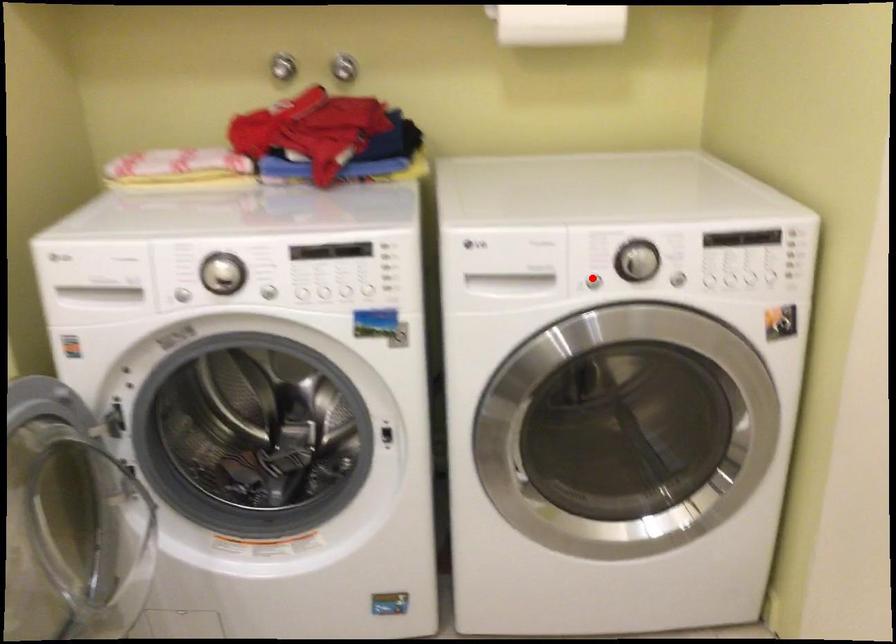
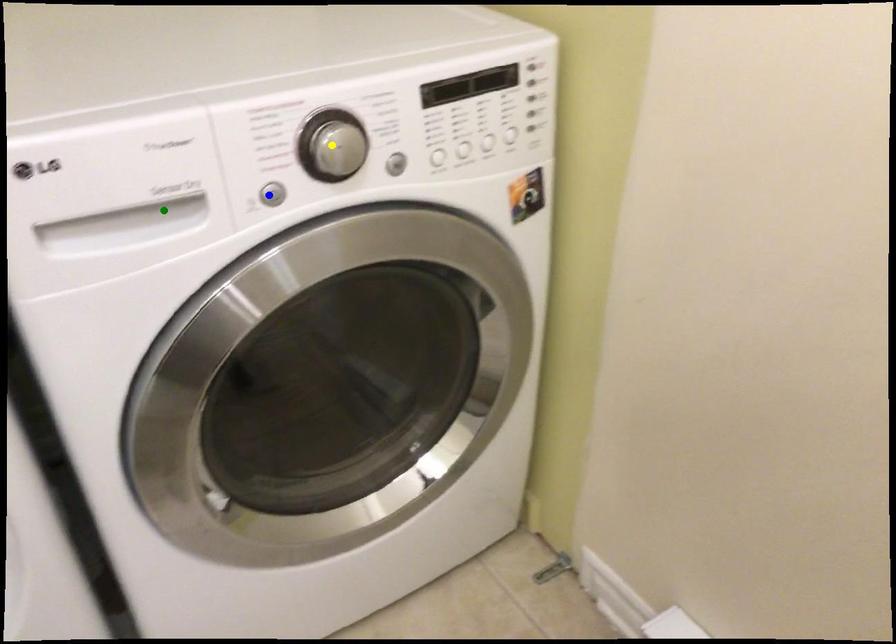
Question: I am providing you with two images of the same scene from different viewpoints. A red point is marked on the first image. You are given multiple points on the second image. Which point in image 2 represents the same 3d spot as the red point in image 1?

Choices:
 (A) yellow point
 (B) blue point
 (C) green point

Answer: (B)